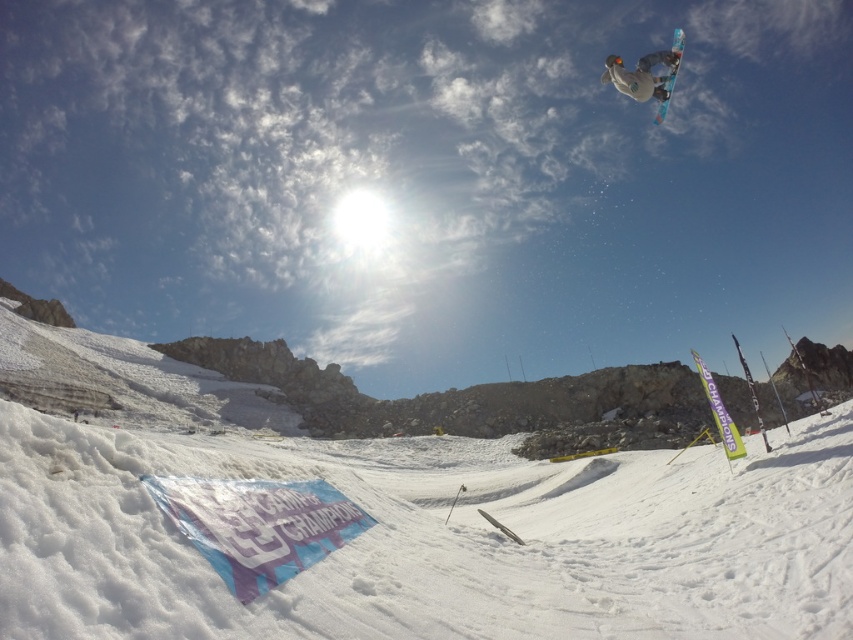
You are a photographer trying to capture the snowboarder and the snow. From your current position, which object is closer to you, the white fluffy snow at lower center or the white matte snowboarder at upper right?

The white fluffy snow at lower center is closer to you because it is in front of the white matte snowboarder at upper right.

You are a photographer at the snowboarding event. You want to capture a photo where both the white matte snowboarder at upper right and the blue glossy snowboard at upper right are clearly visible. Given their positions, which object will appear smaller in the photo?

The white matte snowboarder at upper right will appear smaller in the photo because it has a lesser height compared to the blue glossy snowboard at upper right.